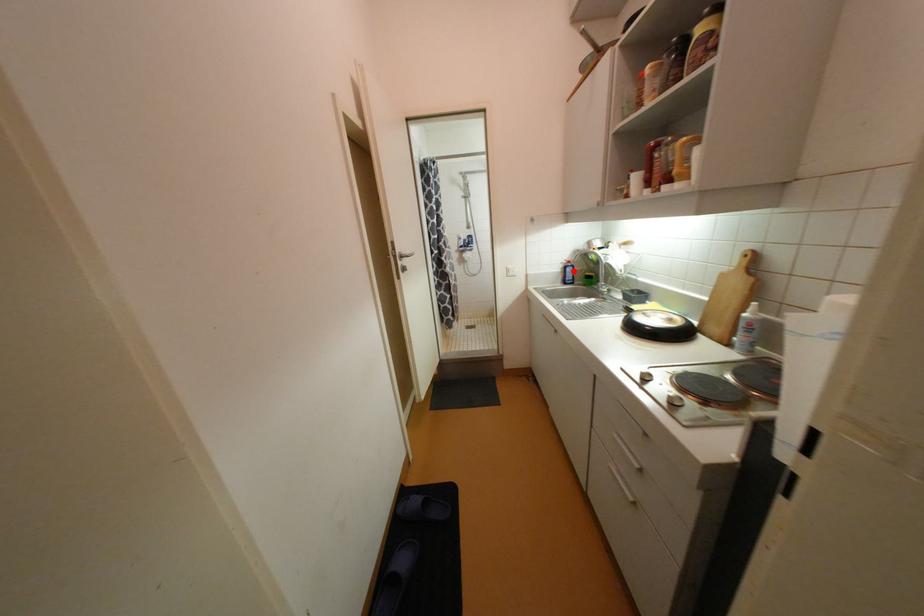
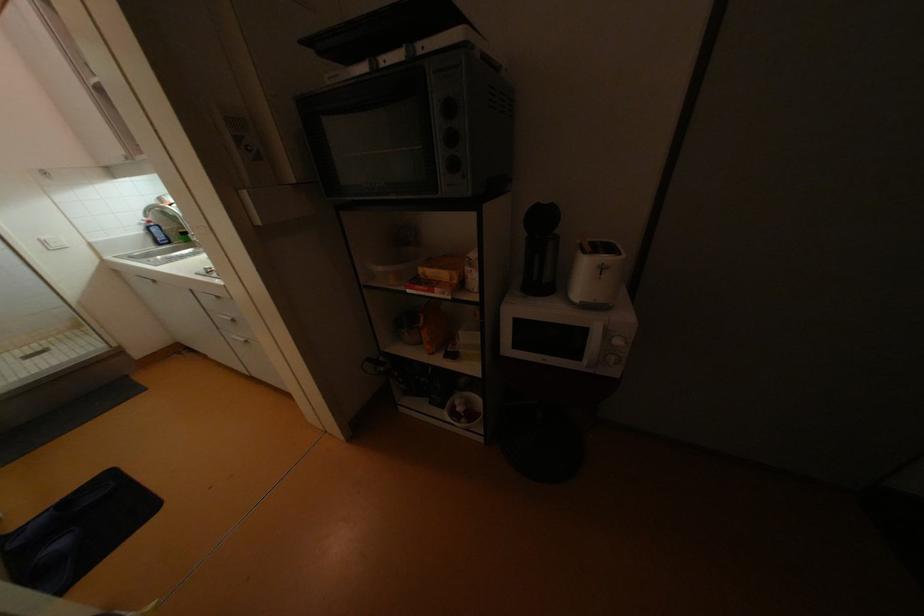
Where in the second image is the point corresponding to the highlighted location from the first image?

(160, 231)